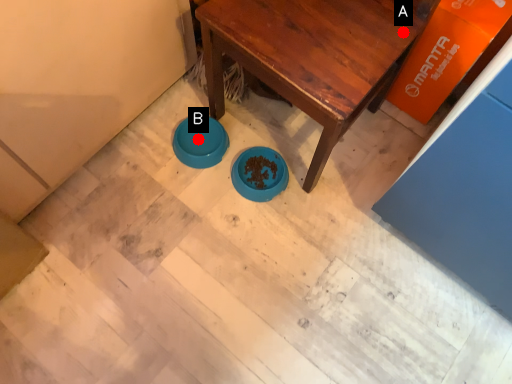
Question: Two points are circled on the image, labeled by A and B beside each circle. Which point is farther from the camera taking this photo?

Choices:
 (A) A is further
 (B) B is further

Answer: (B)